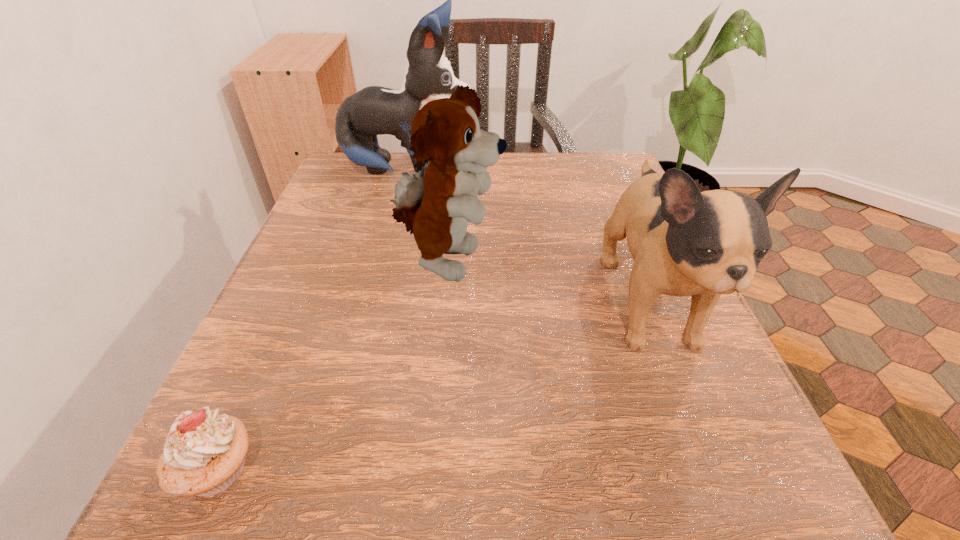
The width and height of the screenshot is (960, 540). In order to click on the farthest puppy in this screenshot , I will do `click(374, 110)`.

Find the location of a particular element. Image resolution: width=960 pixels, height=540 pixels. the rightmost puppy is located at coordinates (684, 242).

Find the location of a particular element. the shortest object is located at coordinates pos(204,453).

Identify the location of the nearest object. The height and width of the screenshot is (540, 960). (204, 453).

Where is `vacant space situated 0.290m on the front-facing side of the farthest puppy`? The image size is (960, 540). vacant space situated 0.290m on the front-facing side of the farthest puppy is located at coordinates (591, 170).

Where is `free space located at the face of the rightmost object`? This screenshot has width=960, height=540. free space located at the face of the rightmost object is located at coordinates (716, 477).

The width and height of the screenshot is (960, 540). Identify the location of free space located 0.300m on the back of the nearest object. point(302,277).

Find the location of `object that is at the far edge`. object that is at the far edge is located at coordinates (374, 110).

The height and width of the screenshot is (540, 960). In order to click on object positioned at the near edge in this screenshot , I will do `click(204, 453)`.

The image size is (960, 540). I want to click on puppy at the left edge, so click(374, 110).